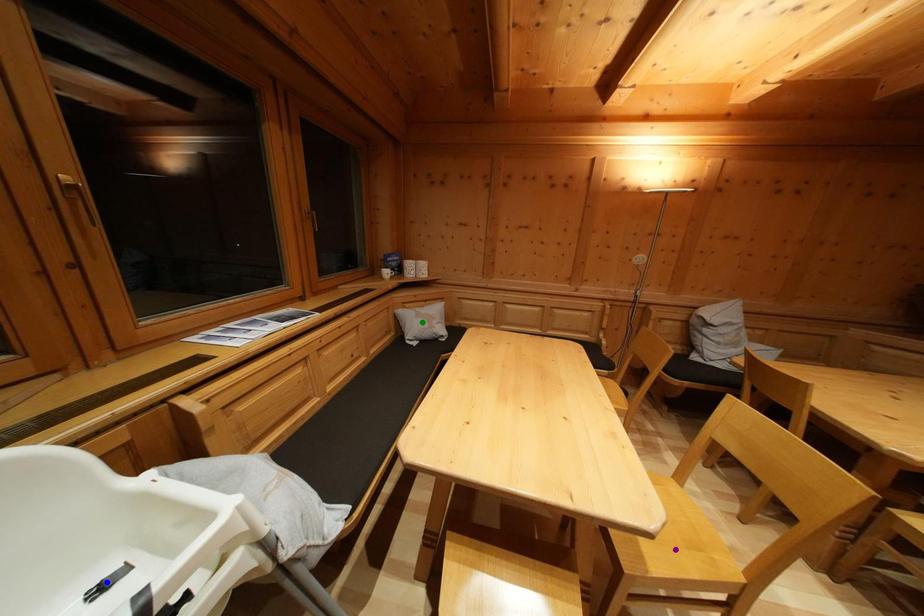
Order these from nearest to farthest:
blue point | green point | purple point

green point, purple point, blue point